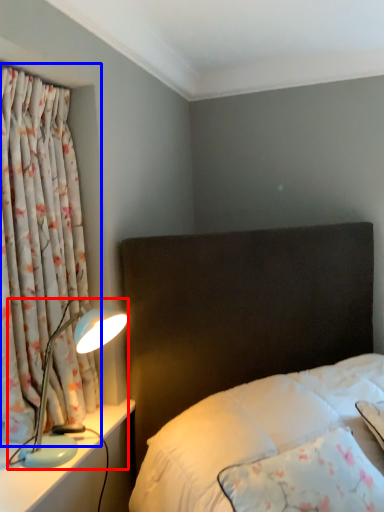
Question: Which point is further to the camera, lamp (highlighted by a red box) or curtain (highlighted by a blue box)?

Choices:
 (A) lamp
 (B) curtain

Answer: (A)